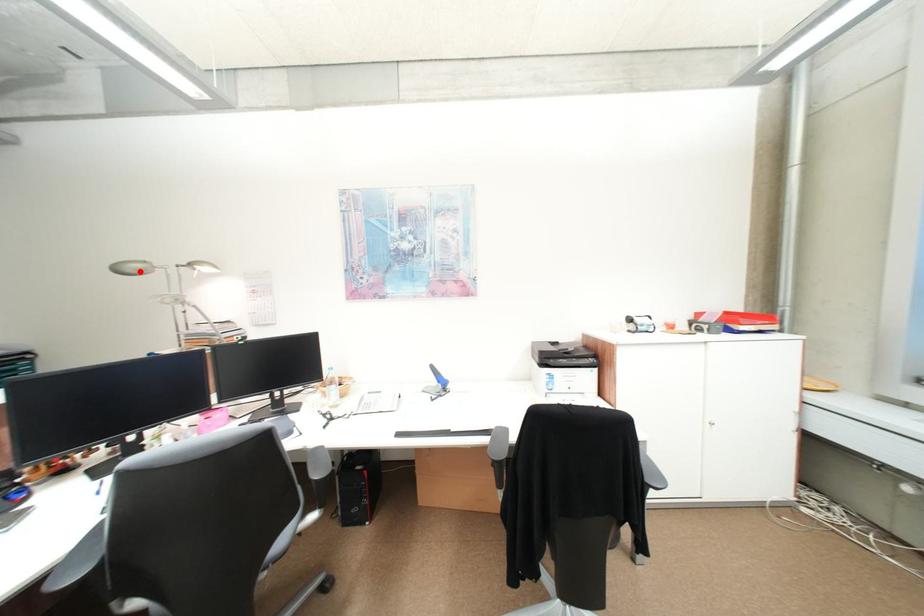
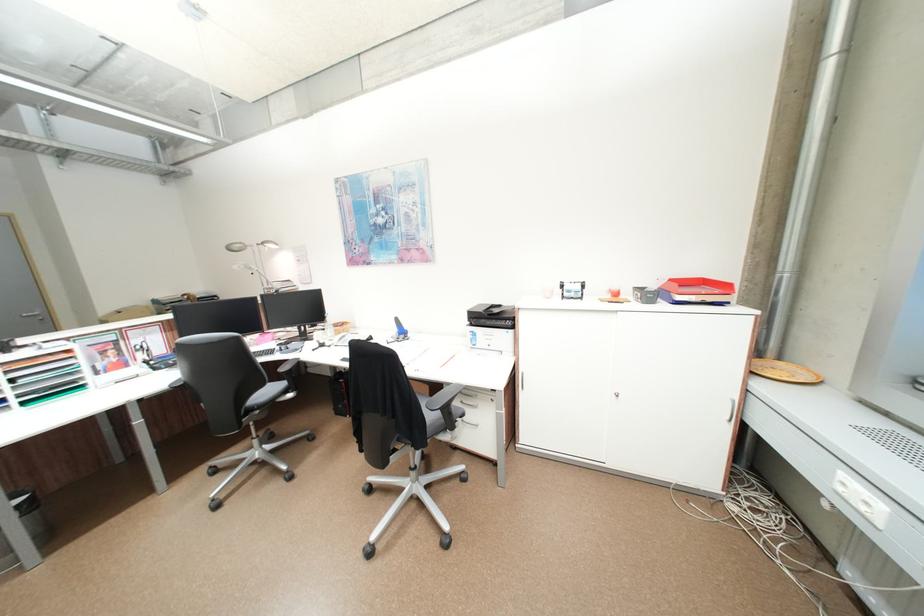
Locate, in the second image, the point that corresponds to the highlighted location in the first image.

(245, 249)